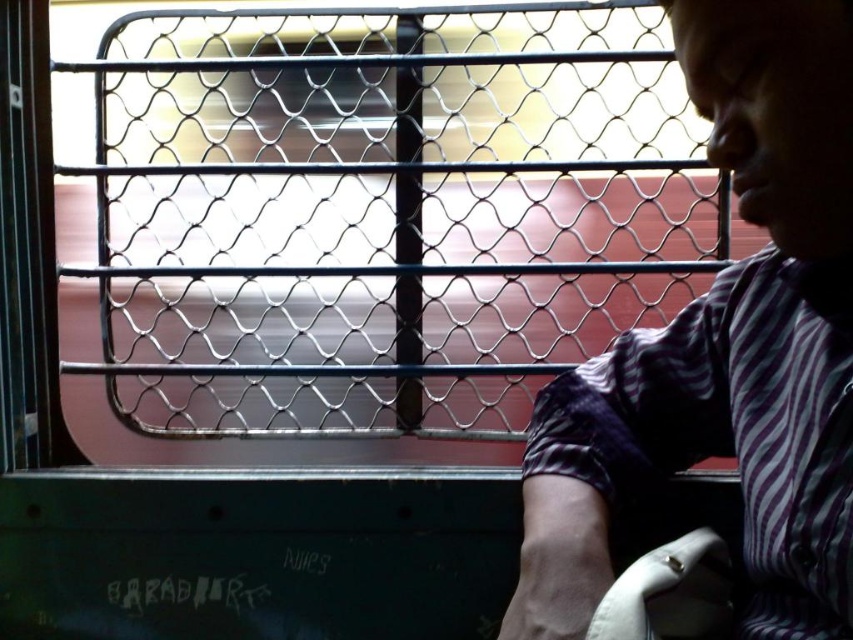
Question: Which of the following is the farthest from the observer?

Choices:
 (A) click(x=556, y=8)
 (B) click(x=821, y=307)

Answer: (A)

Question: Observing the image, what is the correct spatial positioning of metallic mesh at center in reference to purple striped shirt at right?

Choices:
 (A) right
 (B) left

Answer: (B)

Question: Is metallic mesh at center below purple striped shirt at right?

Choices:
 (A) no
 (B) yes

Answer: (A)

Question: Where is metallic mesh at center located in relation to purple striped shirt at right in the image?

Choices:
 (A) left
 (B) right

Answer: (A)